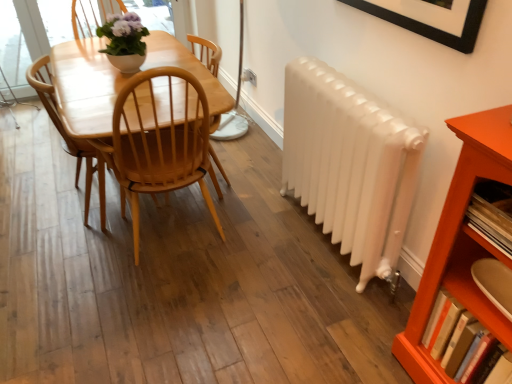
Question: Can you confirm if white glossy radiator at right is shorter than wooden bookshelf at right, the 1th book viewed from the top?

Choices:
 (A) no
 (B) yes

Answer: (A)

Question: Would you say white glossy radiator at right is outside wooden bookshelf at right, the 1th book viewed from the top?

Choices:
 (A) yes
 (B) no

Answer: (A)

Question: From a real-world perspective, does white glossy radiator at right sit lower than wooden bookshelf at right, placed as the second book when sorted from bottom to top?

Choices:
 (A) yes
 (B) no

Answer: (A)

Question: Can you confirm if white glossy radiator at right is taller than wooden bookshelf at right, placed as the second book when sorted from bottom to top?

Choices:
 (A) yes
 (B) no

Answer: (A)

Question: Does white glossy radiator at right appear on the left side of wooden bookshelf at right, placed as the second book when sorted from bottom to top?

Choices:
 (A) no
 (B) yes

Answer: (B)

Question: Considering the positions of wooden bookshelf at right, the 1th book viewed from the top, and light brown wood chair at center in the image, is wooden bookshelf at right, the 1th book viewed from the top, wider or thinner than light brown wood chair at center?

Choices:
 (A) thin
 (B) wide

Answer: (A)

Question: In the image, is wooden bookshelf at right, placed as the second book when sorted from bottom to top, on the left side or the right side of light brown wood chair at center?

Choices:
 (A) right
 (B) left

Answer: (A)

Question: In terms of height, does wooden bookshelf at right, the 1th book viewed from the top, look taller or shorter compared to light brown wood chair at center?

Choices:
 (A) short
 (B) tall

Answer: (A)

Question: From a real-world perspective, is wooden bookshelf at right, the 1th book viewed from the top, positioned above or below light brown wood chair at center?

Choices:
 (A) above
 (B) below

Answer: (A)

Question: Is hardcover book at lower right, the second book when ordered from top to bottom, wider or thinner than light brown wood chair at center?

Choices:
 (A) wide
 (B) thin

Answer: (B)

Question: Which is correct: hardcover book at lower right, the second book when ordered from top to bottom, is inside light brown wood chair at center, or outside of it?

Choices:
 (A) inside
 (B) outside

Answer: (B)

Question: From the image's perspective, relative to light brown wood chair at center, is hardcover book at lower right, the second book when ordered from top to bottom, above or below?

Choices:
 (A) below
 (B) above

Answer: (A)

Question: Considering the relative positions of hardcover book at lower right, the 1th book when ordered from bottom to top, and light brown wood chair at center in the image provided, is hardcover book at lower right, the 1th book when ordered from bottom to top, to the left or to the right of light brown wood chair at center?

Choices:
 (A) left
 (B) right

Answer: (B)

Question: From the image's perspective, is matte white pot at upper center located above or below light brown wood chair at center?

Choices:
 (A) above
 (B) below

Answer: (A)

Question: Looking at their shapes, would you say matte white pot at upper center is wider or thinner than light brown wood chair at center?

Choices:
 (A) thin
 (B) wide

Answer: (A)